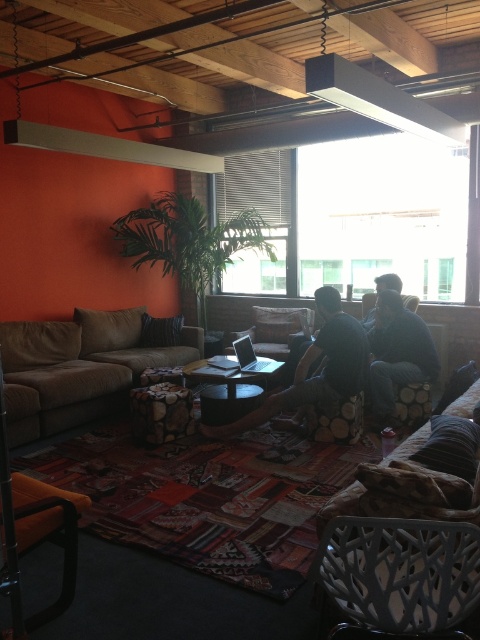
Question: Can you confirm if black textured armchair at center is positioned to the left of dark gray fabric couch at center?

Choices:
 (A) no
 (B) yes

Answer: (A)

Question: Estimate the real-world distances between objects in this image. Which object is farther from the dark gray fabric couch at center?

Choices:
 (A) dark blue jeans at center
 (B) black textured armchair at center
 (C) brown fabric couch at left
 (D) matte white beam at upper center

Answer: (B)

Question: Which object appears closest to the camera in this image?

Choices:
 (A) dark gray fabric couch at center
 (B) dark blue jeans at center

Answer: (A)

Question: Where is brown fabric couch at left located in relation to matte white beam at upper center in the image?

Choices:
 (A) left
 (B) right

Answer: (A)

Question: Which object is positioned closest to the dark blue jeans at center?

Choices:
 (A) brown fabric couch at left
 (B) black textured armchair at center

Answer: (A)

Question: In this image, where is dark blue jeans at center located relative to matte white beam at upper center?

Choices:
 (A) below
 (B) above

Answer: (A)